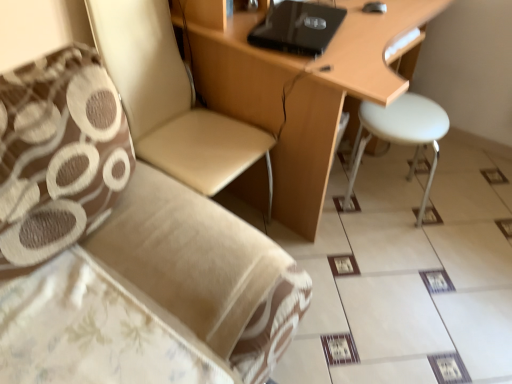
The height and width of the screenshot is (384, 512). I want to click on vacant region in front of white plastic stool at right, so click(x=402, y=261).